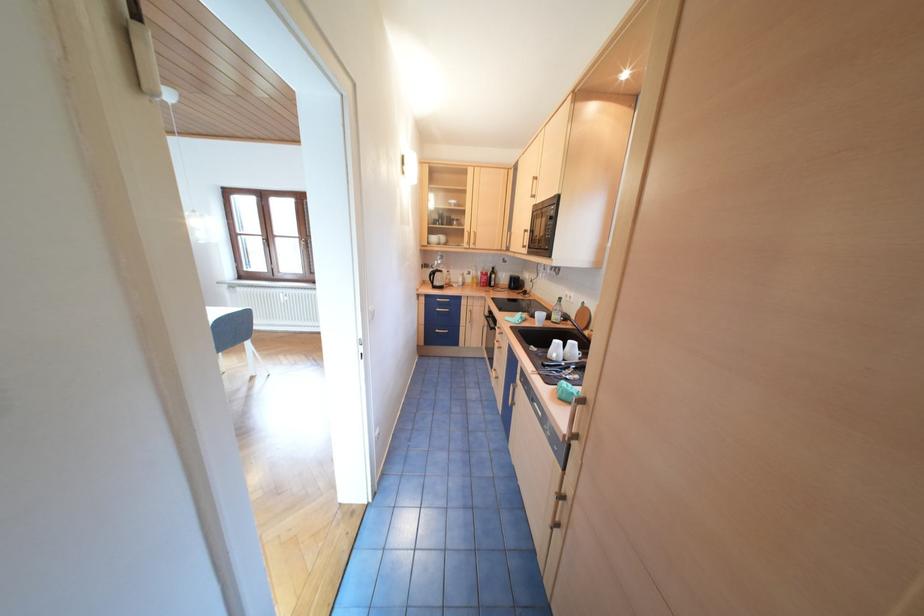
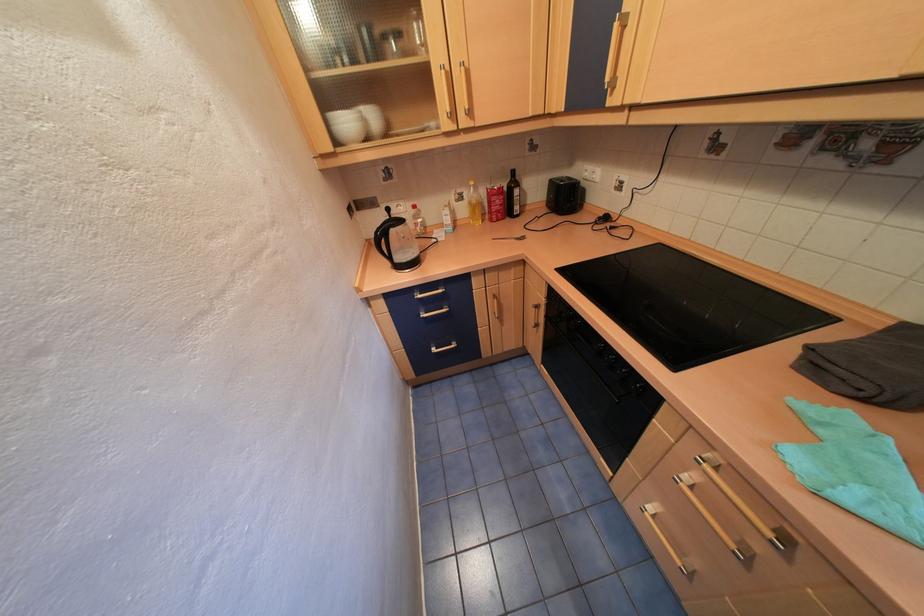
The point at (479, 280) is marked in the first image. Where is the corresponding point in the second image?

(472, 211)